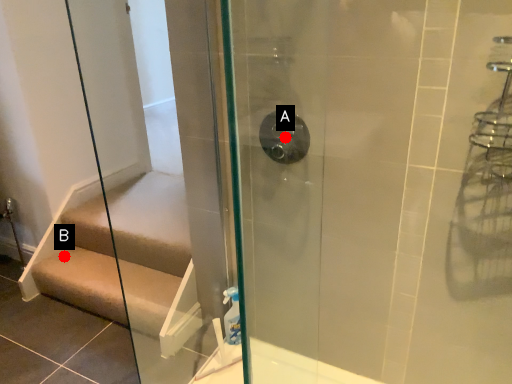
Question: Two points are circled on the image, labeled by A and B beside each circle. Among these points, which one is nearest to the camera?

Choices:
 (A) A is closer
 (B) B is closer

Answer: (A)